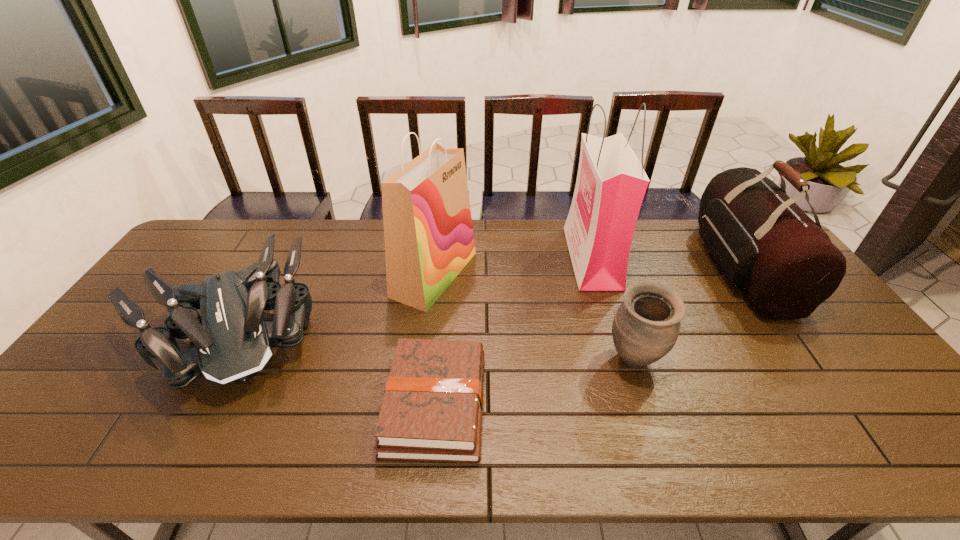
The image size is (960, 540). I want to click on free space between the shortest object and the right shopping bag, so click(514, 331).

The width and height of the screenshot is (960, 540). Identify the location of free space between the right shopping bag and the duffel bag. (666, 263).

Locate an element on the screen. Image resolution: width=960 pixels, height=540 pixels. blank region between the fourth tallest object and the rightmost object is located at coordinates (687, 314).

The height and width of the screenshot is (540, 960). In order to click on vacant area between the shortest object and the urn in this screenshot , I will do `click(535, 382)`.

The width and height of the screenshot is (960, 540). In order to click on free space between the right shopping bag and the rightmost object in this screenshot , I will do `click(666, 263)`.

Locate an element on the screen. This screenshot has width=960, height=540. free space between the shortest object and the fourth tallest object is located at coordinates (535, 382).

The width and height of the screenshot is (960, 540). Find the location of `vacant space that's between the leftmost object and the rightmost object`. vacant space that's between the leftmost object and the rightmost object is located at coordinates (484, 300).

Find the location of a particular element. blank region between the right shopping bag and the shortest object is located at coordinates [514, 331].

The width and height of the screenshot is (960, 540). I want to click on object that is the fifth closest one to the fifth tallest object, so click(785, 265).

Locate which object ranks in proximity to the leftmost object. Please provide its 2D coordinates. Your answer should be formatted as a tuple, i.e. [(x, y)], where the tuple contains the x and y coordinates of a point satisfying the conditions above.

[(428, 233)]